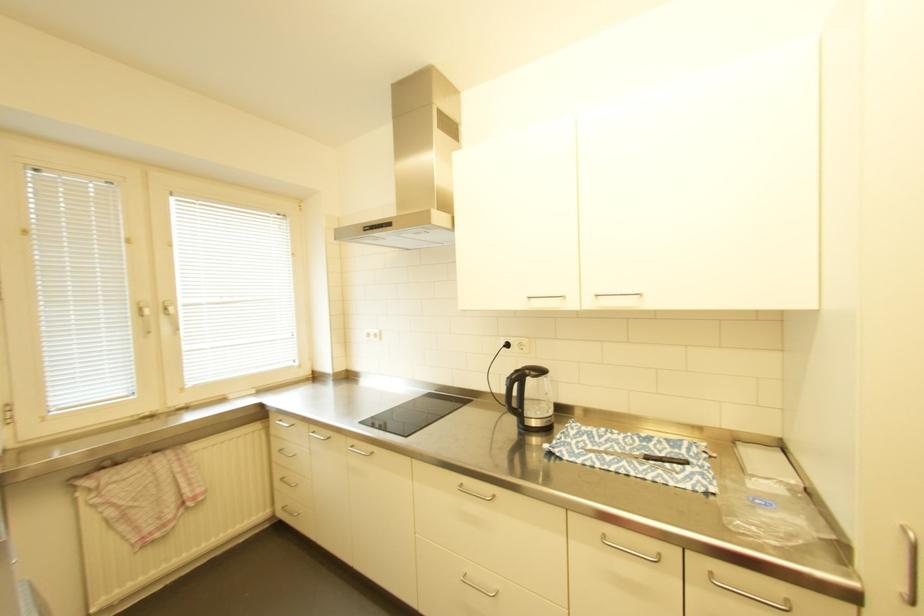
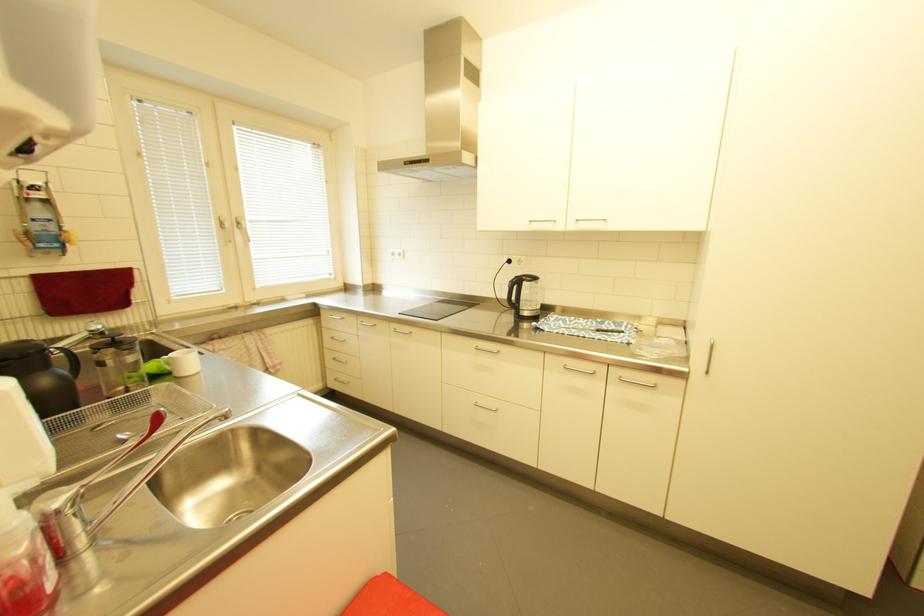
Question: In a continuous first-person perspective shot, in which direction is the camera moving?

Choices:
 (A) Left
 (B) Right
 (C) Forward
 (D) Backward

Answer: (D)